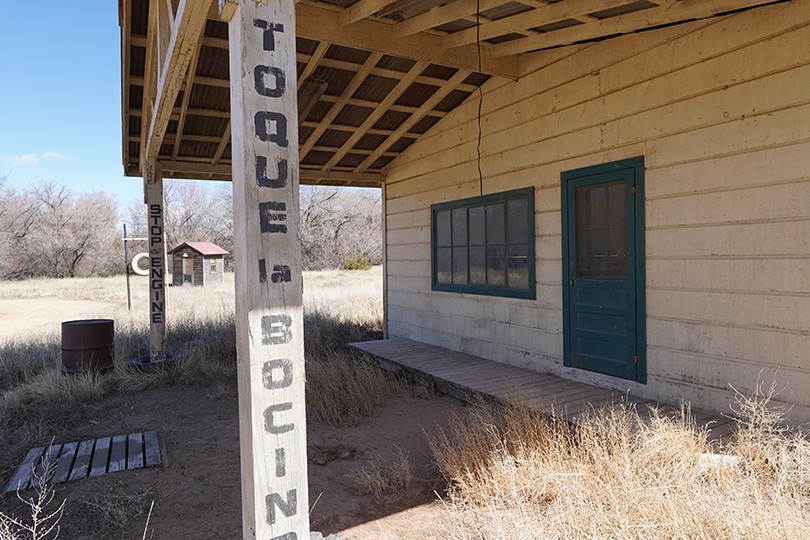
This screenshot has height=540, width=810. Find the location of `windows`. windows is located at coordinates (476, 238), (604, 231).